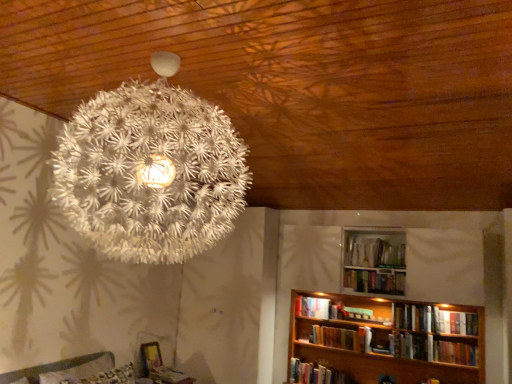
Locate an element on the screen. free space above white matte bookshelf at lower right, the sixth book viewed from the right (from a real-world perspective) is located at coordinates (323, 365).